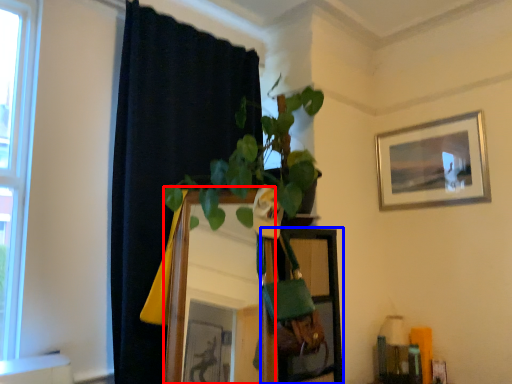
Question: Which object is further to the camera taking this photo, mirror (highlighted by a red box) or shelf (highlighted by a blue box)?

Choices:
 (A) mirror
 (B) shelf

Answer: (B)